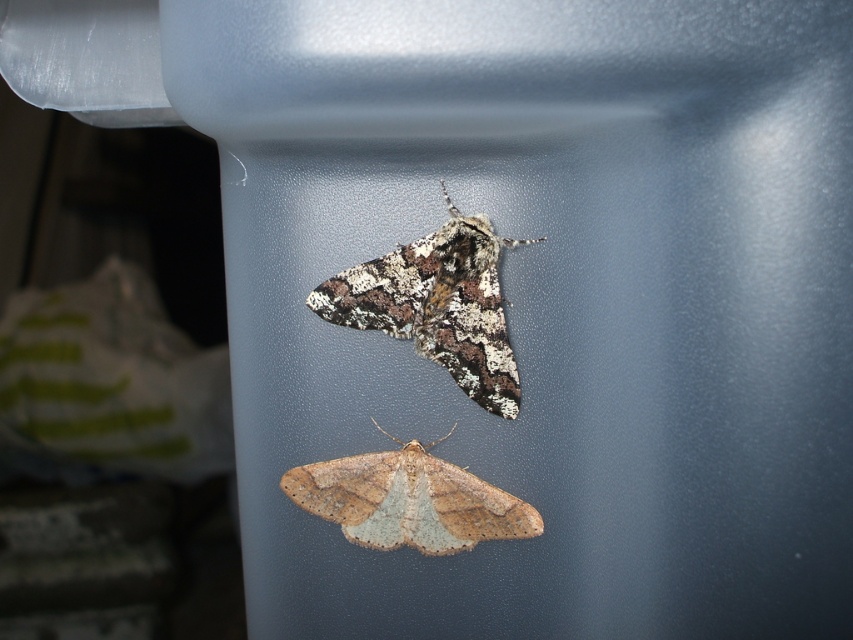
Question: Among these objects, which one is nearest to the camera?

Choices:
 (A) brown speckled moth at center
 (B) speckled brown moth at center

Answer: (B)

Question: Among these points, which one is farthest from the camera?

Choices:
 (A) (354, 492)
 (B) (450, 236)

Answer: (A)

Question: Is speckled brown moth at center below brown speckled moth at center?

Choices:
 (A) yes
 (B) no

Answer: (B)

Question: Can you confirm if speckled brown moth at center is wider than brown speckled moth at center?

Choices:
 (A) yes
 (B) no

Answer: (B)

Question: In this image, where is speckled brown moth at center located relative to brown speckled moth at center?

Choices:
 (A) right
 (B) left

Answer: (A)